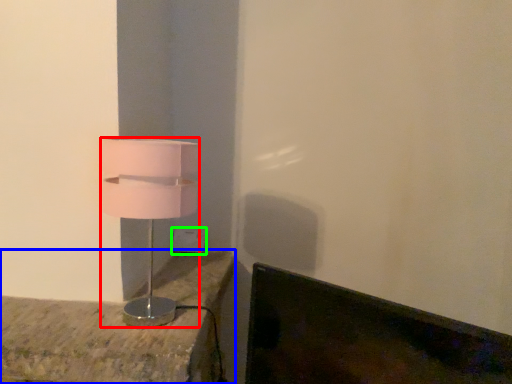
Question: Which object is positioned closest to lamp (highlighted by a red box)? Select from furniture (highlighted by a blue box) and electric outlet (highlighted by a green box).

Choices:
 (A) furniture
 (B) electric outlet

Answer: (A)